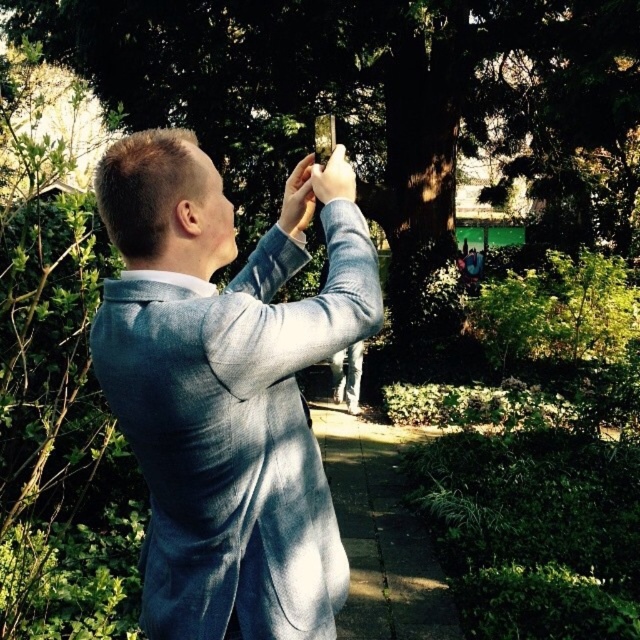
Is concrete sidewalk at center thinner than matte gray phone at center?

Incorrect, concrete sidewalk at center's width is not less than matte gray phone at center's.

Is concrete sidewalk at center wider than matte gray phone at center?

Yes, concrete sidewalk at center is wider than matte gray phone at center.

Locate an element on the screen. concrete sidewalk at center is located at coordinates (380, 534).

Between matte blue hand at upper center and matte gray phone at center, which one is positioned higher?

matte gray phone at center

Where is `matte blue hand at upper center`? matte blue hand at upper center is located at coordinates point(298,198).

Based on the photo, who is shorter, light blue textured blazer at center or concrete sidewalk at center?

concrete sidewalk at center

Between light blue textured blazer at center and concrete sidewalk at center, which one is positioned higher?

light blue textured blazer at center is higher up.

Find the location of `light blue textured blazer at center`. light blue textured blazer at center is located at coordinates (224, 394).